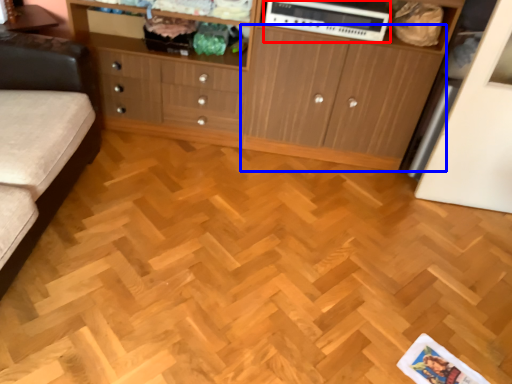
Question: Which of the following is the closest to the observer, appliance (highlighted by a red box) or cupboard (highlighted by a blue box)?

Choices:
 (A) appliance
 (B) cupboard

Answer: (B)